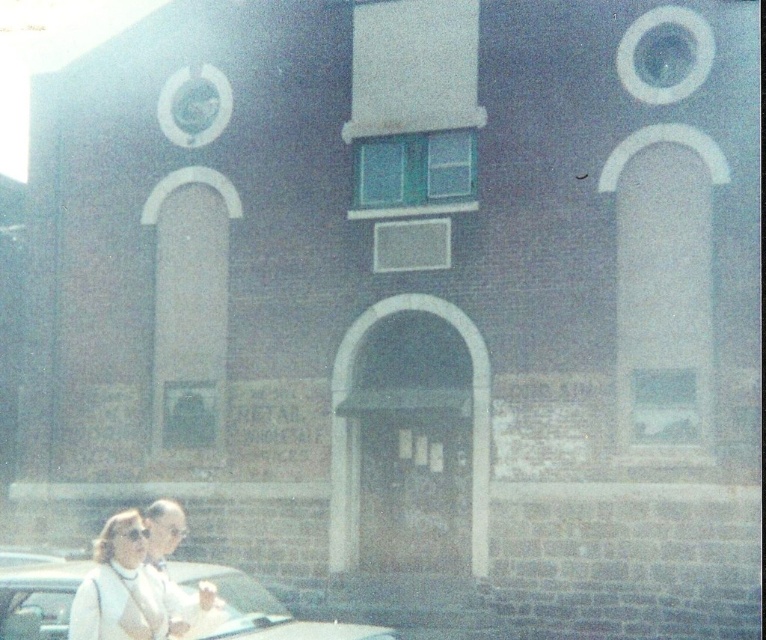
Question: Which object is positioned closest to the white matte jacket at lower left?

Choices:
 (A) metallic silver car at lower left
 (B) white fabric coat at lower left

Answer: (A)

Question: Which object appears closest to the camera in this image?

Choices:
 (A) white fabric coat at lower left
 (B) metallic silver car at lower left
 (C) white matte jacket at lower left

Answer: (C)

Question: Which object is the closest to the metallic silver car at lower left?

Choices:
 (A) white matte jacket at lower left
 (B) white fabric coat at lower left

Answer: (A)

Question: Can you confirm if metallic silver car at lower left is positioned to the right of white matte jacket at lower left?

Choices:
 (A) no
 (B) yes

Answer: (A)

Question: Is metallic silver car at lower left further to camera compared to white matte jacket at lower left?

Choices:
 (A) yes
 (B) no

Answer: (A)

Question: Can you confirm if metallic silver car at lower left is positioned below white matte jacket at lower left?

Choices:
 (A) yes
 (B) no

Answer: (A)